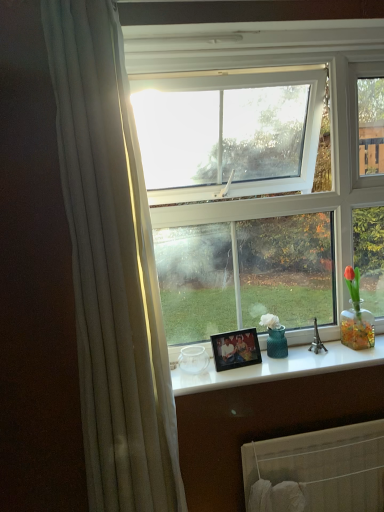
Where is `empty space that is ontop of white glossy counter top at center`? empty space that is ontop of white glossy counter top at center is located at coordinates (290, 360).